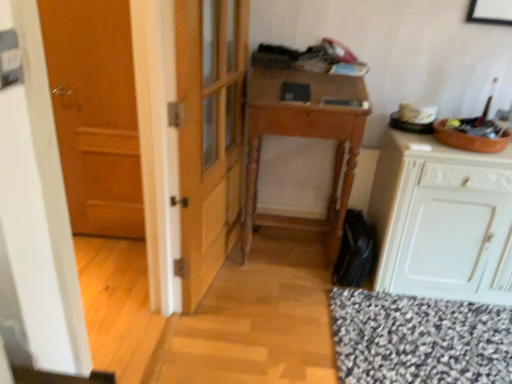
Question: From the image's perspective, does white painted wood cabinet at right appear higher than wooden door at left?

Choices:
 (A) yes
 (B) no

Answer: (B)

Question: Is the position of white painted wood cabinet at right more distant than that of wooden door at left?

Choices:
 (A) yes
 (B) no

Answer: (B)

Question: Does white painted wood cabinet at right have a smaller size compared to wooden door at left?

Choices:
 (A) yes
 (B) no

Answer: (B)

Question: Is the surface of white painted wood cabinet at right in direct contact with wooden door at left?

Choices:
 (A) yes
 (B) no

Answer: (B)

Question: Is white painted wood cabinet at right positioned with its back to wooden door at left?

Choices:
 (A) no
 (B) yes

Answer: (A)

Question: Considering the relative positions of white painted wood cabinet at right and wooden door at left in the image provided, is white painted wood cabinet at right in front of wooden door at left?

Choices:
 (A) no
 (B) yes

Answer: (B)

Question: Is wooden door at left not close to white painted wood cabinet at right?

Choices:
 (A) yes
 (B) no

Answer: (A)

Question: From a real-world perspective, does wooden door at left sit lower than white painted wood cabinet at right?

Choices:
 (A) yes
 (B) no

Answer: (B)

Question: From the image's perspective, is wooden door at left under white painted wood cabinet at right?

Choices:
 (A) yes
 (B) no

Answer: (B)

Question: Is wooden door at left to the right of white painted wood cabinet at right from the viewer's perspective?

Choices:
 (A) no
 (B) yes

Answer: (A)

Question: Is wooden door at left positioned behind white painted wood cabinet at right?

Choices:
 (A) yes
 (B) no

Answer: (A)

Question: Can white painted wood cabinet at right be found inside wooden door at left?

Choices:
 (A) yes
 (B) no

Answer: (B)

Question: Is white painted wood cabinet at right oriented towards wooden desk at center?

Choices:
 (A) no
 (B) yes

Answer: (A)